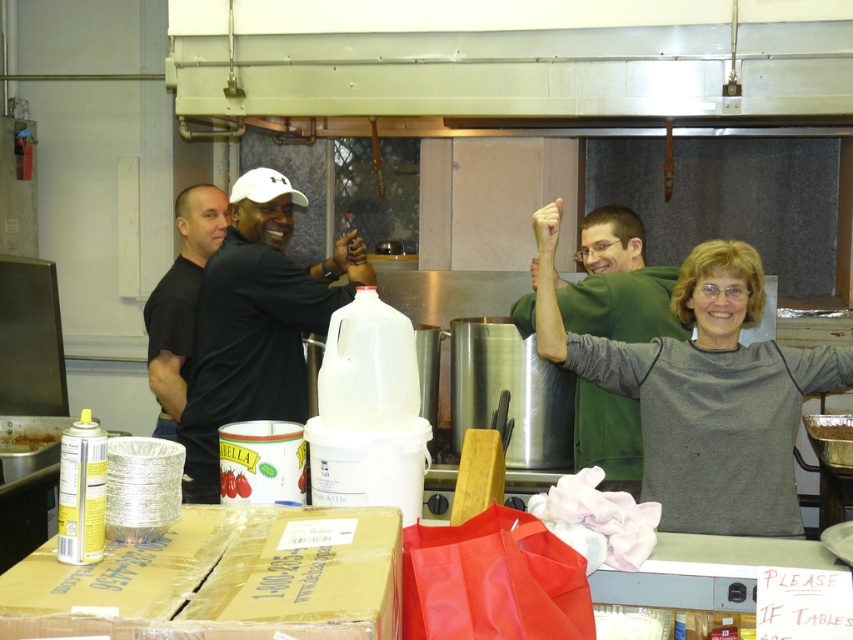
Question: Which object is the closest to the brown leather hand at center?

Choices:
 (A) purple matte skin at upper center
 (B) metallic silver exhaust hood at upper center

Answer: (A)

Question: Which object is closer to the camera taking this photo?

Choices:
 (A) black matte shirt at left
 (B) brown leather hand at center
 (C) smooth skin hand at upper right
 (D) green matte shirt at center

Answer: (D)

Question: Does black matte shirt at center have a greater width compared to metallic foil container at center?

Choices:
 (A) yes
 (B) no

Answer: (A)

Question: Which point is farther to the camera?

Choices:
 (A) (563, 36)
 (B) (0, 449)
 (C) (158, 301)

Answer: (C)

Question: Can you confirm if shiny aluminum foil at lower left is bigger than smooth skin hand at upper right?

Choices:
 (A) no
 (B) yes

Answer: (A)

Question: Does gray matte sweater at center have a smaller size compared to brown leather hand at center?

Choices:
 (A) yes
 (B) no

Answer: (B)